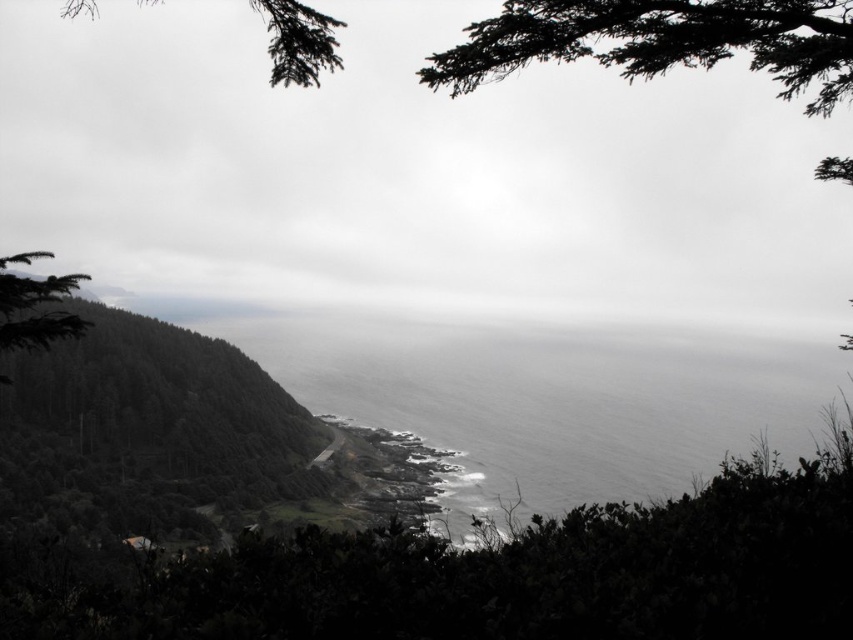
Is gray matte water at center above green matte tree at upper left?

Actually, gray matte water at center is below green matte tree at upper left.

At what (x,y) coordinates should I click in order to perform the action: click on gray matte water at center. Please return your answer as a coordinate pair (x, y). The image size is (853, 640). Looking at the image, I should click on (552, 400).